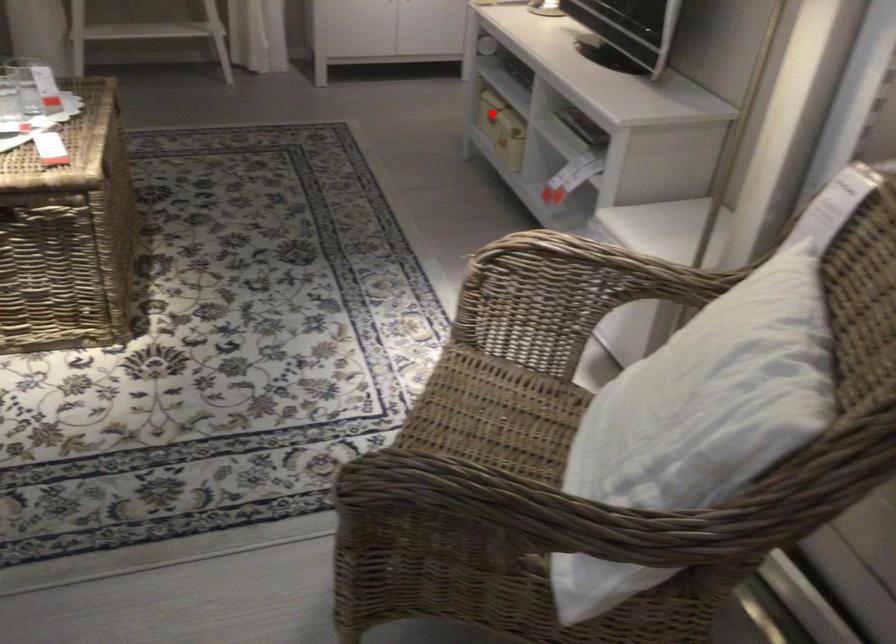
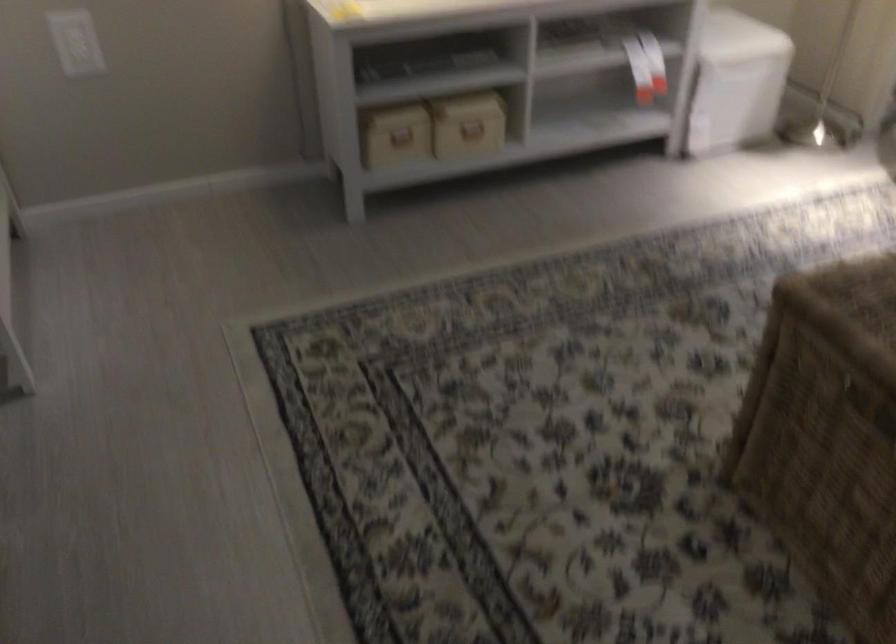
The point at the highlighted location is marked in the first image. Where is the corresponding point in the second image?

(401, 136)